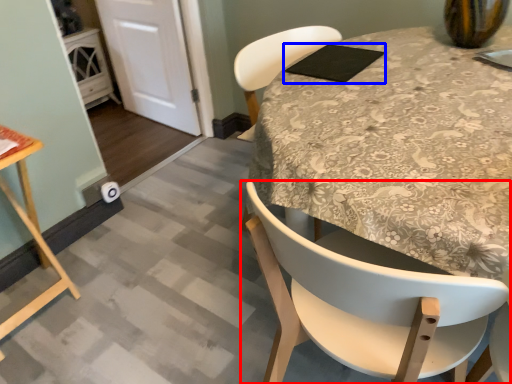
Question: Which point is closer to the camera, chair (highlighted by a red box) or pad (highlighted by a blue box)?

Choices:
 (A) chair
 (B) pad

Answer: (A)